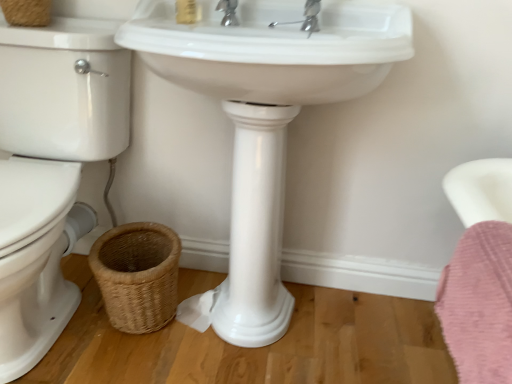
The image size is (512, 384). Find the location of `blank area to the left of woven natural basket at lower left, the 1th basket from the bottom`. blank area to the left of woven natural basket at lower left, the 1th basket from the bottom is located at coordinates (70, 322).